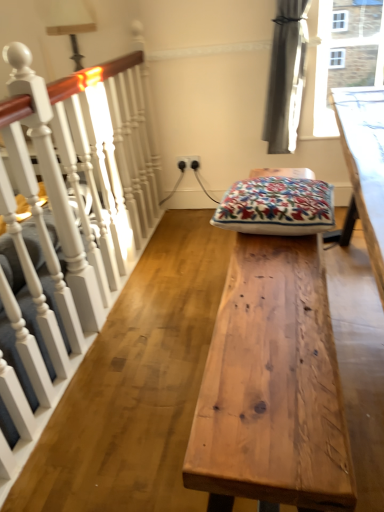
Where is `free space to the left of natural wood table at center`? free space to the left of natural wood table at center is located at coordinates (138, 382).